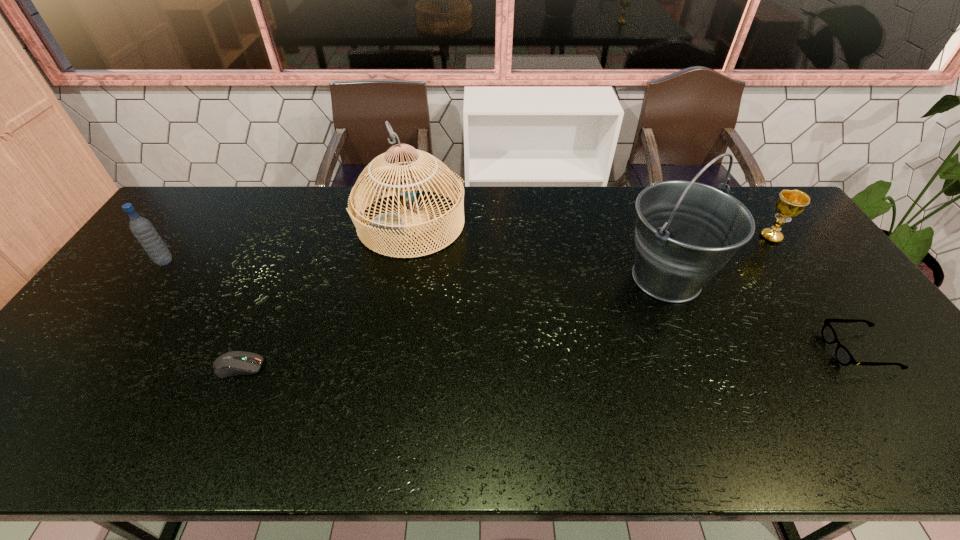
This screenshot has height=540, width=960. In order to click on the third object from right to left in this screenshot , I will do `click(686, 231)`.

Identify the location of the fourth object from right to left. The image size is (960, 540). (391, 223).

You are a GUI agent. You are given a task and a screenshot of the screen. Output one action in this format:
    pyautogui.click(x=<x>, y=<y>)
    Task: Click on the leftmost object
    The image size is (960, 540).
    Given the screenshot: What is the action you would take?
    tap(146, 234)

You are a GUI agent. You are given a task and a screenshot of the screen. Output one action in this format:
    pyautogui.click(x=<x>, y=<y>)
    Task: Click on the water bottle
    This screenshot has height=540, width=960.
    Given the screenshot: What is the action you would take?
    pyautogui.click(x=146, y=234)

Identify the location of the third shortest object. The image size is (960, 540). (790, 203).

This screenshot has height=540, width=960. What are the coordinates of `spectacles` in the screenshot? It's located at (843, 356).

You are a GUI agent. You are given a task and a screenshot of the screen. Output one action in this format:
    pyautogui.click(x=<x>, y=<y>)
    Task: Click on the shortest object
    The height and width of the screenshot is (540, 960).
    Given the screenshot: What is the action you would take?
    pyautogui.click(x=232, y=363)

Identify the location of the fifth object from right to left. (232, 363).

Identify the location of vacant space located on the right of the fourth object from left to right. (746, 278).

The width and height of the screenshot is (960, 540). I want to click on vacant space located on the left of the third object from left to right, so click(x=327, y=222).